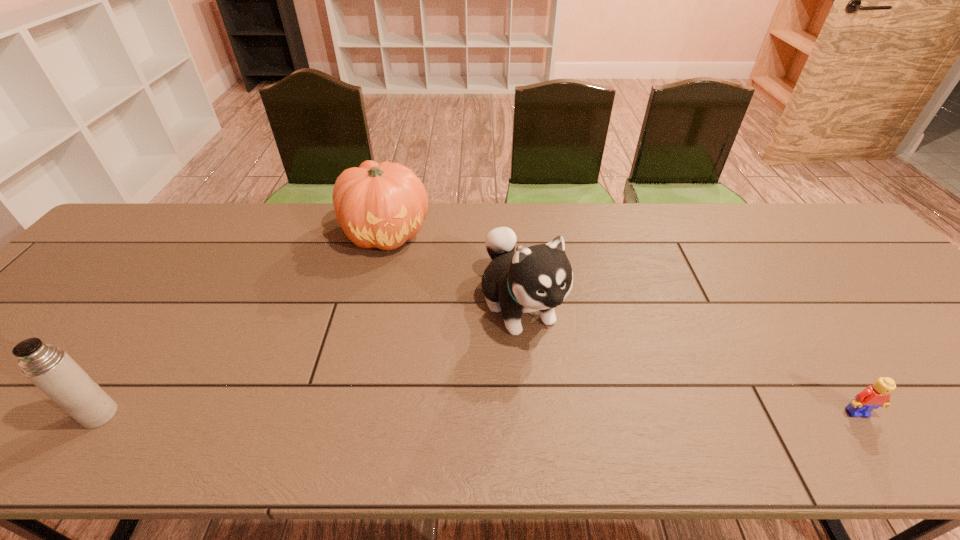
Identify the location of free space located on the carved face of the third object from right to left. The height and width of the screenshot is (540, 960). (446, 349).

You are a GUI agent. You are given a task and a screenshot of the screen. Output one action in this format:
    pyautogui.click(x=<x>, y=<y>)
    Task: Click on the vacant area situated at the face of the puppy
    This screenshot has width=960, height=540.
    Given the screenshot: What is the action you would take?
    pyautogui.click(x=563, y=392)

This screenshot has height=540, width=960. In order to click on blank area located at the face of the puppy in this screenshot , I will do `click(574, 411)`.

Identify the location of object at the far edge. (383, 205).

This screenshot has width=960, height=540. What are the coordinates of `thermos bottle positioned at the near edge` in the screenshot? It's located at (51, 369).

At what (x,y) coordinates should I click in order to perform the action: click on Lego that is at the near edge. Please return your answer as a coordinate pair (x, y). The height and width of the screenshot is (540, 960). Looking at the image, I should click on (x=872, y=397).

Find the location of a particular element. This screenshot has height=540, width=960. vacant space at the far edge of the desktop is located at coordinates (539, 225).

Locate an element on the screen. The width and height of the screenshot is (960, 540). vacant space at the right edge of the desktop is located at coordinates (889, 274).

Where is `free space at the far left corner of the desktop`? The width and height of the screenshot is (960, 540). free space at the far left corner of the desktop is located at coordinates click(x=131, y=215).

Locate an element on the screen. free region at the far right corner is located at coordinates (825, 226).